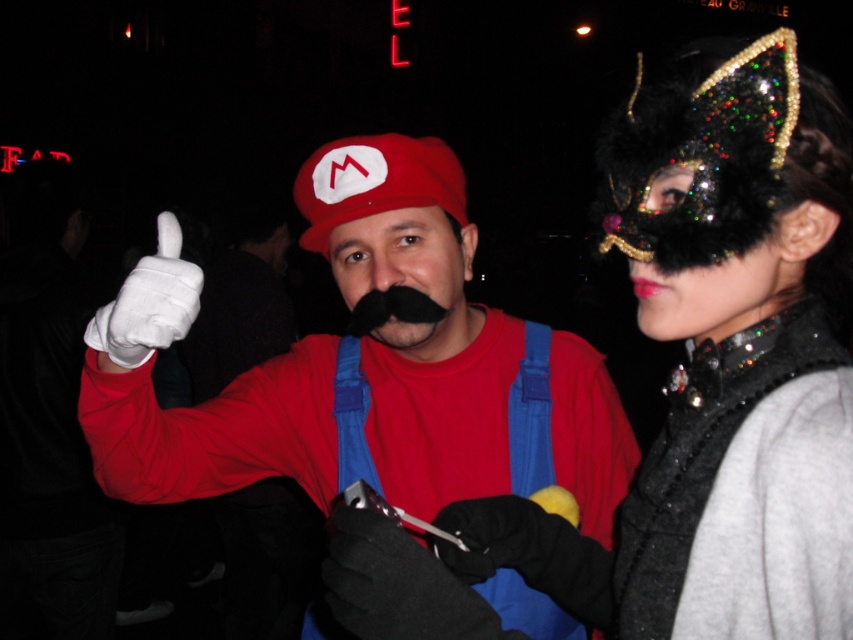
Where is `matte red cap at center`? matte red cap at center is located at coordinates (363, 365).

Does matte red cap at center have a greater height compared to black leather gloves at center?

Correct, matte red cap at center is much taller as black leather gloves at center.

Which is in front, point (430, 173) or point (340, 572)?

Positioned in front is point (340, 572).

Identify the location of matte red cap at center. (363, 365).

Is white cotton glove at center below black fuzzy mustache at center?

Actually, white cotton glove at center is above black fuzzy mustache at center.

Between white cotton glove at center and black fuzzy mustache at center, which one has more height?

white cotton glove at center

Is point (161, 282) positioned after point (422, 310)?

No, (161, 282) is closer to viewer.

Locate an element on the screen. The image size is (853, 640). white cotton glove at center is located at coordinates (x=149, y=304).

Looking at this image, does black leather gloves at center have a larger size compared to black fuzzy mustache at center?

Correct, black leather gloves at center is larger in size than black fuzzy mustache at center.

Identify the location of black leather gloves at center. (397, 584).

Is point (445, 596) farther from viewer compared to point (366, 296)?

No.

I want to click on black leather gloves at center, so click(397, 584).